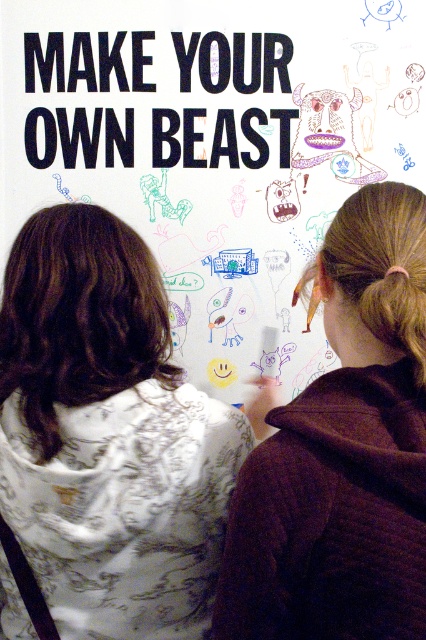
Question: Is white printed hoodie at left to the right of blackmaterial/texture at upper center from the viewer's perspective?

Choices:
 (A) no
 (B) yes

Answer: (B)

Question: Which point is farther from the camera taking this photo?

Choices:
 (A) 94,336
 (B) 380,188
 (C) 180,570
 (D) 46,42

Answer: (D)

Question: Which of the following is the farthest from the observer?

Choices:
 (A) brown quilted hoodie at upper right
 (B) dark brown hair at upper left

Answer: (B)

Question: Does dark brown hair at upper left appear on the right side of blackmaterial/texture at upper center?

Choices:
 (A) yes
 (B) no

Answer: (B)

Question: Can you confirm if brown quilted hoodie at upper right is positioned to the left of blackmaterial/texture at upper center?

Choices:
 (A) yes
 (B) no

Answer: (B)

Question: Which point is closer to the camera?

Choices:
 (A) brown quilted hoodie at upper right
 (B) white printed hoodie at left
 (C) blackmaterial/texture at upper center
 (D) dark brown hair at upper left

Answer: (A)